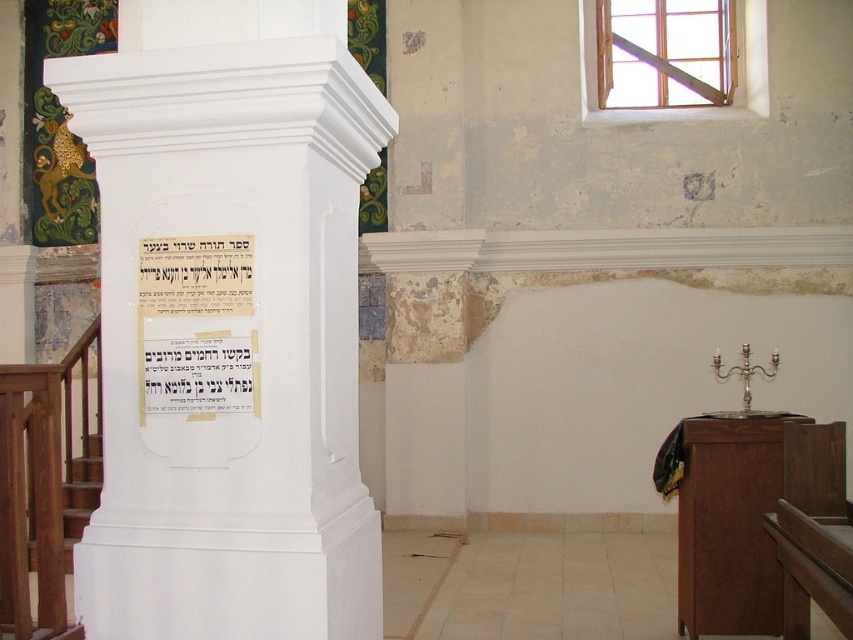
Question: Can you confirm if white smooth pillar at center is wider than matte paper scroll at center?

Choices:
 (A) yes
 (B) no

Answer: (A)

Question: Does matte paper scroll at center appear under brown wooden stairs at lower left?

Choices:
 (A) no
 (B) yes

Answer: (A)

Question: Which point is farther to the camera?

Choices:
 (A) matte paper scroll at center
 (B) white smooth pillar at center

Answer: (A)

Question: Is white smooth pillar at center positioned at the back of brown wooden stairs at lower left?

Choices:
 (A) no
 (B) yes

Answer: (A)

Question: Which point is closer to the camera taking this photo?

Choices:
 (A) (33, 570)
 (B) (193, 189)

Answer: (B)

Question: Among these objects, which one is farthest from the camera?

Choices:
 (A) white smooth pillar at center
 (B) matte paper scroll at center

Answer: (B)